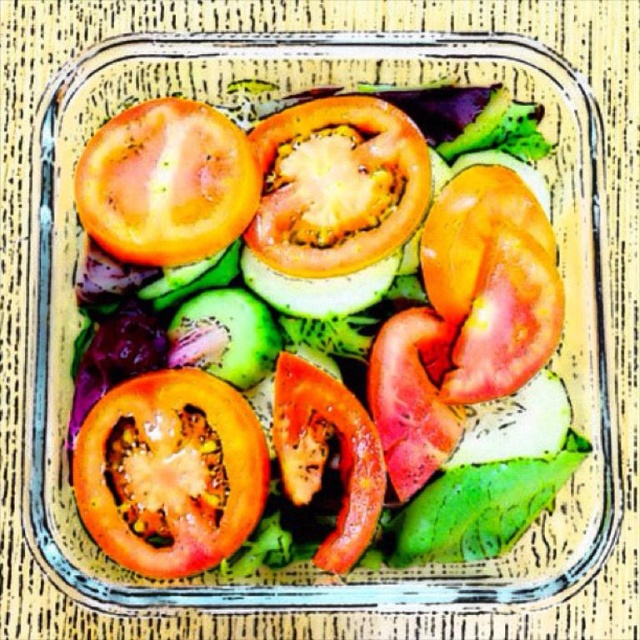
You are a food stylist arranging a salad in a square glass container. You have the juicy tomato slices at center and the red matte tomato at lower left. Based on their positions, which one is closer to the top of the container?

The juicy tomato slices at center is above the red matte tomato at lower left, so it is closer to the top of the container.

You are a food stylist arranging a salad in a square glass container. You have the juicy tomato slices at center and the red matte tomato at lower left. Which tomato has a greater height?

The juicy tomato slices at center is much taller than the red matte tomato at lower left, so the juicy tomato slices at center has a greater height.

You are a food critic analyzing the placement of ingredients in the salad container. According to the coordinates provided, where exactly are the juicy tomato slices at center located in the container?

The juicy tomato slices at center are located at the coordinates point (314, 332).